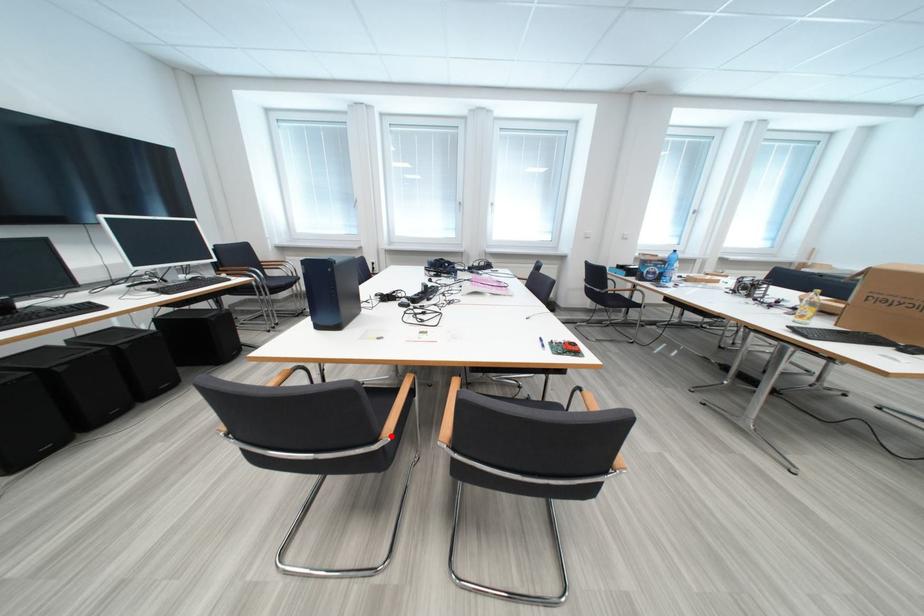
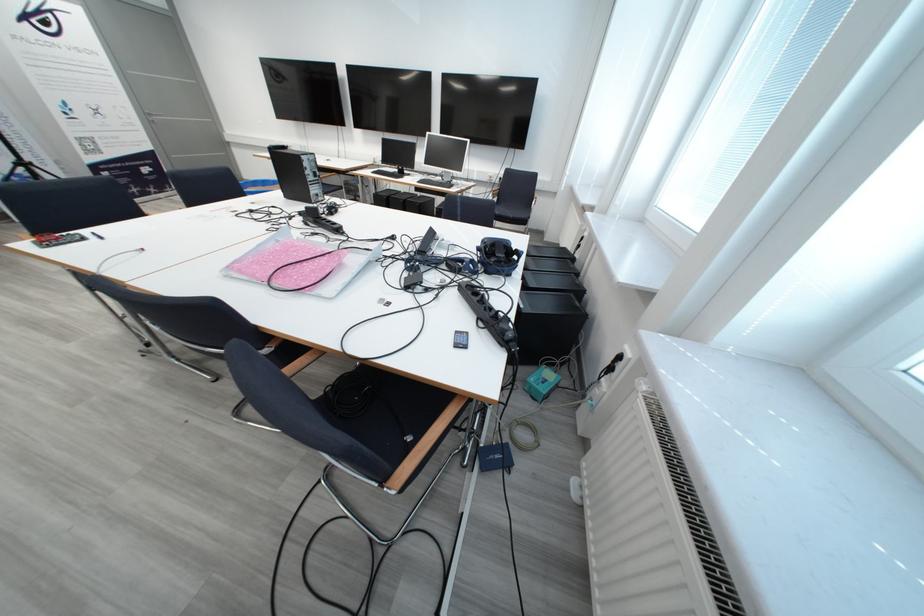
Question: I am providing you with two images of the same scene from different viewpoints. A red point is marked on the first image. At the location where the point appears in image 1, is it still visible in image 2?

Choices:
 (A) Yes
 (B) No

Answer: (B)